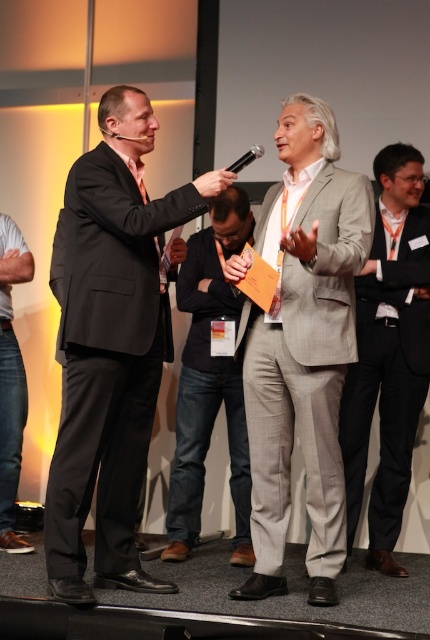
You are standing in the event setting and see the point at coordinates (387, 378). Which object is this point located on?

The point at coordinates (387, 378) is located on the light gray wool suit at center.

You are attending a formal event and need to find the tallest pair of jeans in the room. You see the dark gray jeans at center and the denim jeans at lower left. Which pair should you choose?

The dark gray jeans at center is taller than the denim jeans at lower left, so you should choose the dark gray jeans at center.

You are a photographer at a formal event and need to adjust the lighting to ensure both the gray textured suit at center and the light gray wool suit at center are well lit. Based on their positions, which suit should you focus the light on first?

The gray textured suit at center is above the light gray wool suit at center, so you should focus the light on the gray textured suit at center first to ensure proper illumination from top to bottom.